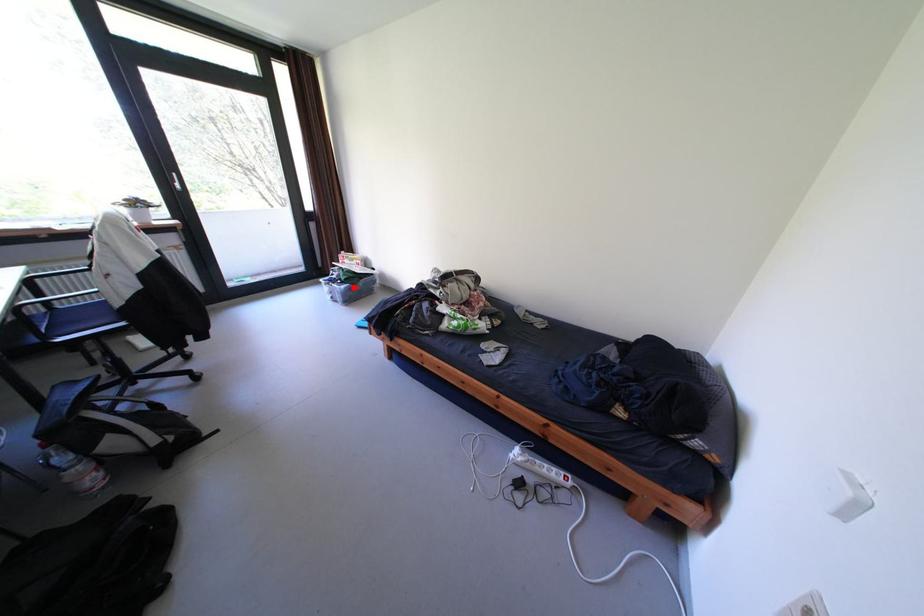
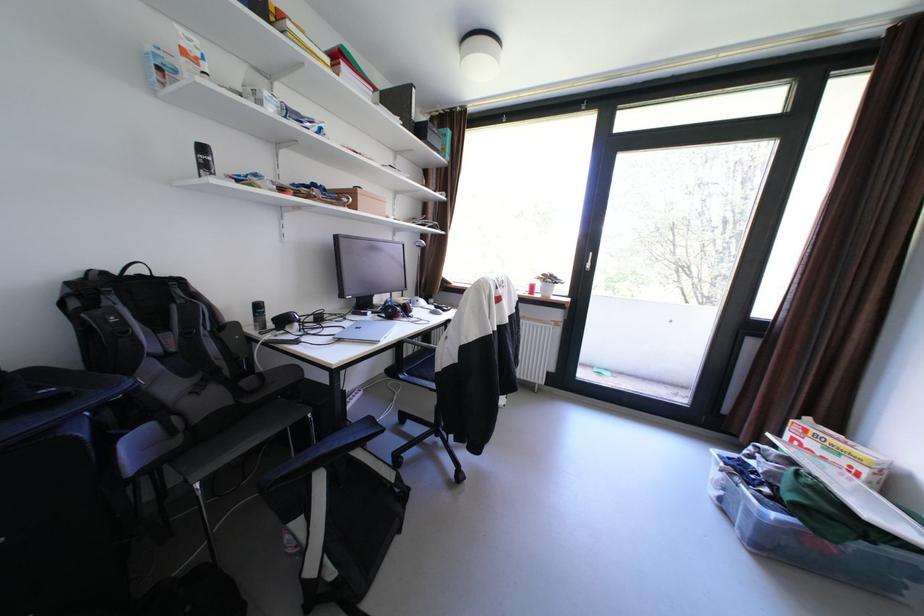
The point at the highlighted location is marked in the first image. Where is the corresponding point in the second image?

(784, 516)